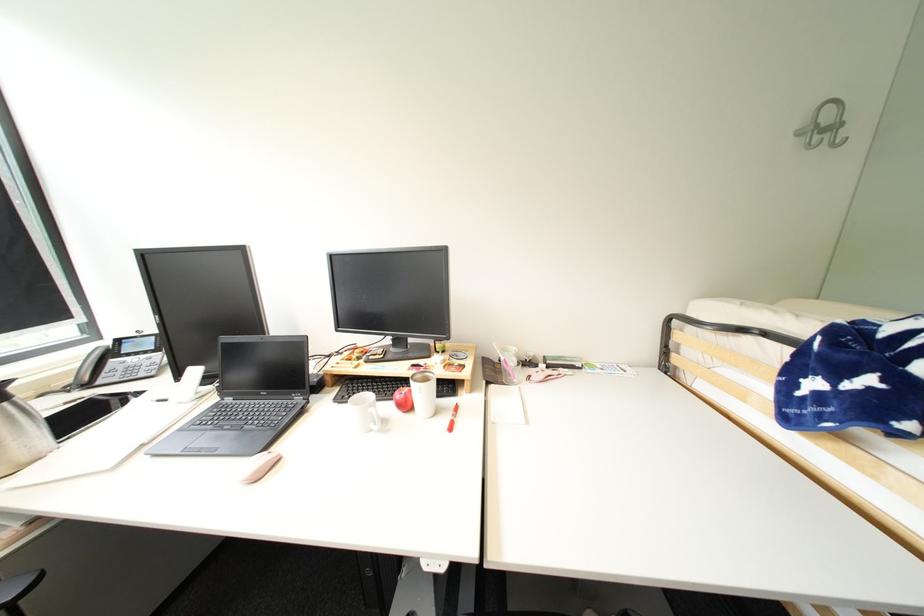
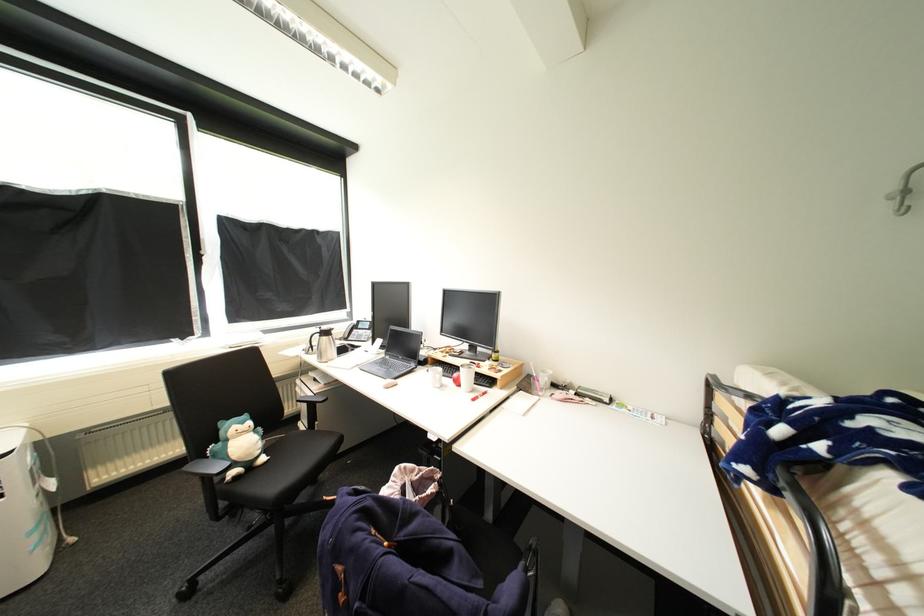
Locate, in the second image, the point that corresponds to point (405, 397) in the first image.

(462, 376)